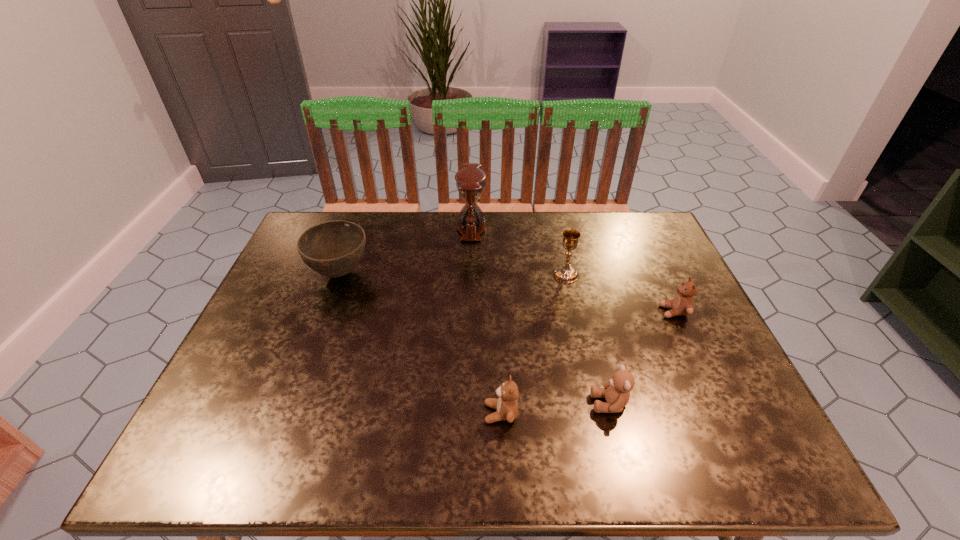
The width and height of the screenshot is (960, 540). I want to click on free space between the second teddy bear from left to right and the chalice, so tap(588, 339).

Find the location of a particular element. The image size is (960, 540). object that stands as the fourth closest to the farthest teddy bear is located at coordinates (470, 181).

The image size is (960, 540). I want to click on object that is the third closest one to the third nearest object, so click(x=506, y=405).

Find the location of `teddy bear identified as the closest to the rightmost teddy bear`. teddy bear identified as the closest to the rightmost teddy bear is located at coordinates (616, 391).

Identify which teddy bear is the third closest to the chalice. Please provide its 2D coordinates. Your answer should be formatted as a tuple, i.e. [(x, y)], where the tuple contains the x and y coordinates of a point satisfying the conditions above.

[(506, 405)]

Locate an element on the screen. The height and width of the screenshot is (540, 960). free space that satisfies the following two spatial constraints: 1. on the front side of the tallest object; 2. on the right side of the chalice is located at coordinates (470, 274).